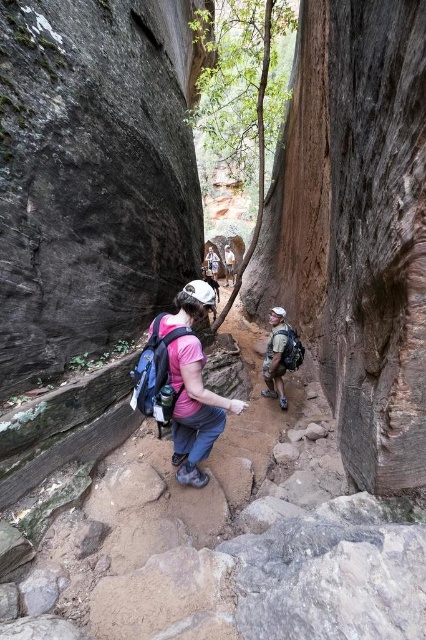
Question: Which object appears closest to the camera in this image?

Choices:
 (A) matte gray backpack at center
 (B) matte pink shirt at center

Answer: (B)

Question: Which of the following is the farthest from the observer?

Choices:
 (A) (264, 372)
 (B) (166, 352)

Answer: (A)

Question: Does matte pink shirt at center have a larger size compared to matte gray backpack at center?

Choices:
 (A) no
 (B) yes

Answer: (B)

Question: Is matte pink shirt at center closer to camera compared to matte gray backpack at center?

Choices:
 (A) no
 (B) yes

Answer: (B)

Question: Can you confirm if matte pink shirt at center is positioned to the right of matte gray backpack at center?

Choices:
 (A) yes
 (B) no

Answer: (B)